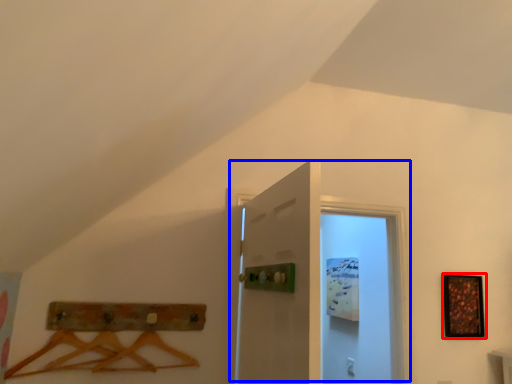
Question: Which object appears farthest to the camera in this image, picture frame (highlighted by a red box) or door (highlighted by a blue box)?

Choices:
 (A) picture frame
 (B) door

Answer: (A)